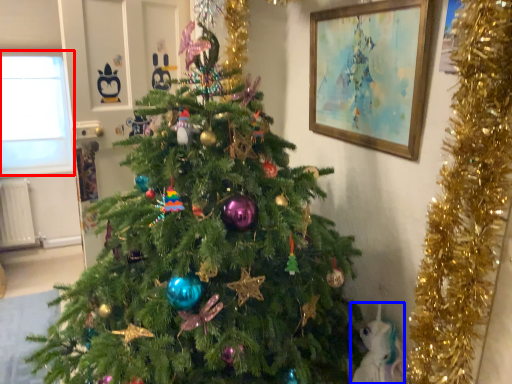
Question: Which object appears farthest to the camera in this image, window screen (highlighted by a red box) or animal (highlighted by a blue box)?

Choices:
 (A) window screen
 (B) animal

Answer: (A)